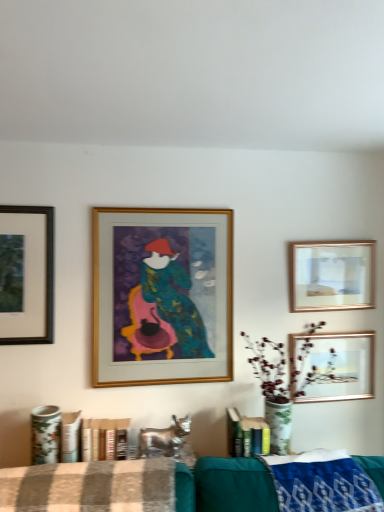
Question: From the image's perspective, is brown checkered fabric at lower center on metallic gold picture frame at upper right, the 1th picture frame when ordered from right to left?

Choices:
 (A) yes
 (B) no

Answer: (B)

Question: Does brown checkered fabric at lower center have a greater width compared to metallic gold picture frame at upper right, placed as the 4th picture frame when sorted from left to right?

Choices:
 (A) no
 (B) yes

Answer: (B)

Question: Is brown checkered fabric at lower center closer to camera compared to metallic gold picture frame at upper right, placed as the 4th picture frame when sorted from left to right?

Choices:
 (A) yes
 (B) no

Answer: (A)

Question: Is brown checkered fabric at lower center facing towards metallic gold picture frame at upper right, the 1th picture frame when ordered from right to left?

Choices:
 (A) no
 (B) yes

Answer: (A)

Question: Can you confirm if brown checkered fabric at lower center is thinner than metallic gold picture frame at upper right, placed as the 4th picture frame when sorted from left to right?

Choices:
 (A) yes
 (B) no

Answer: (B)

Question: Looking at their shapes, would you say matte black frame at upper left, placed as the 4th picture frame when sorted from right to left, is wider or thinner than gold metallic picture frame at center, which ranks as the second picture frame in left-to-right order?

Choices:
 (A) thin
 (B) wide

Answer: (A)

Question: Does point (21, 253) appear closer or farther from the camera than point (147, 306)?

Choices:
 (A) closer
 (B) farther

Answer: (A)

Question: From a real-world perspective, is matte black frame at upper left, which is the 1th picture frame in left-to-right order, positioned above or below gold metallic picture frame at center, which is the third picture frame from right to left?

Choices:
 (A) above
 (B) below

Answer: (A)

Question: Looking at the image, does matte black frame at upper left, which is the 1th picture frame in left-to-right order, seem bigger or smaller compared to gold metallic picture frame at center, which is the third picture frame from right to left?

Choices:
 (A) small
 (B) big

Answer: (A)

Question: Is brown checkered fabric at lower center bigger or smaller than metallic gold picture frame at upper right, the 1th picture frame when ordered from right to left?

Choices:
 (A) small
 (B) big

Answer: (B)

Question: Considering the positions of brown checkered fabric at lower center and metallic gold picture frame at upper right, the 1th picture frame when ordered from right to left, in the image, is brown checkered fabric at lower center wider or thinner than metallic gold picture frame at upper right, the 1th picture frame when ordered from right to left,?

Choices:
 (A) wide
 (B) thin

Answer: (A)

Question: Would you say brown checkered fabric at lower center is inside or outside metallic gold picture frame at upper right, placed as the 4th picture frame when sorted from left to right?

Choices:
 (A) inside
 (B) outside

Answer: (B)

Question: Is brown checkered fabric at lower center in front of or behind metallic gold picture frame at upper right, placed as the 4th picture frame when sorted from left to right, in the image?

Choices:
 (A) behind
 (B) front

Answer: (B)

Question: Considering the positions of blue woven blanket at lower right and matte black frame at upper left, placed as the 4th picture frame when sorted from right to left, in the image, is blue woven blanket at lower right taller or shorter than matte black frame at upper left, placed as the 4th picture frame when sorted from right to left,?

Choices:
 (A) short
 (B) tall

Answer: (A)

Question: Is blue woven blanket at lower right wider or thinner than matte black frame at upper left, which is the 1th picture frame in left-to-right order?

Choices:
 (A) thin
 (B) wide

Answer: (B)